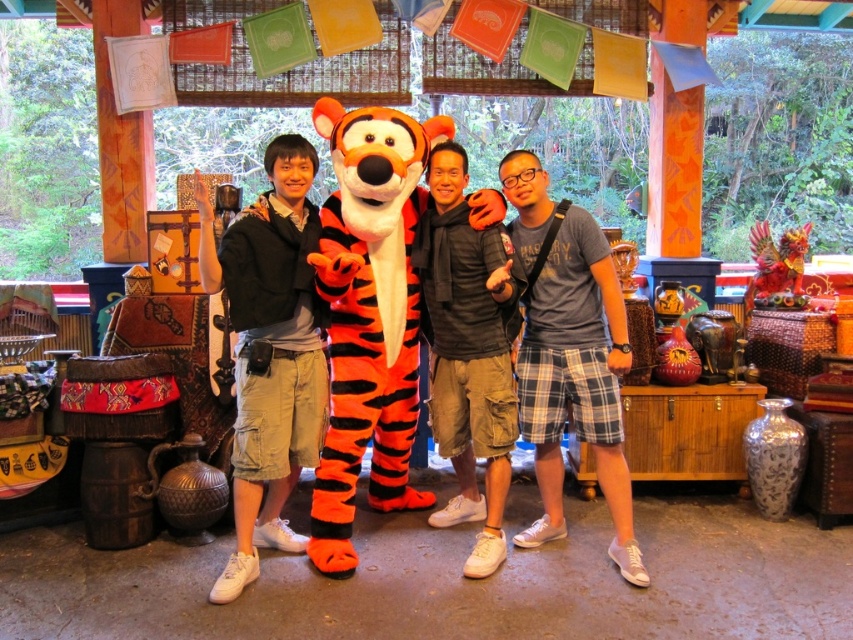
You are standing in the themed area and want to take a photo with the Tigger character. When you look at the orange plush tiger at center and the matte black jacket at center, which one appears higher in the photo?

The orange plush tiger at center is positioned over the matte black jacket at center, so it appears higher in the photo.

You are a photographer trying to adjust the lighting for a group photo. The subjects are wearing a matte black jacket at center and blue plaid shorts at center. Which clothing item would cast a narrower shadow due to its width?

The matte black jacket at center is thinner than the blue plaid shorts at center, so it would cast a narrower shadow.

Based on the photo, you are a photographer trying to capture a clear shot of the matte black jacket at center and the blue plaid shorts at center. Which clothing item is covering part of the other?

The matte black jacket at center is positioned over blue plaid shorts at center, so it is covering part of the blue plaid shorts at center.